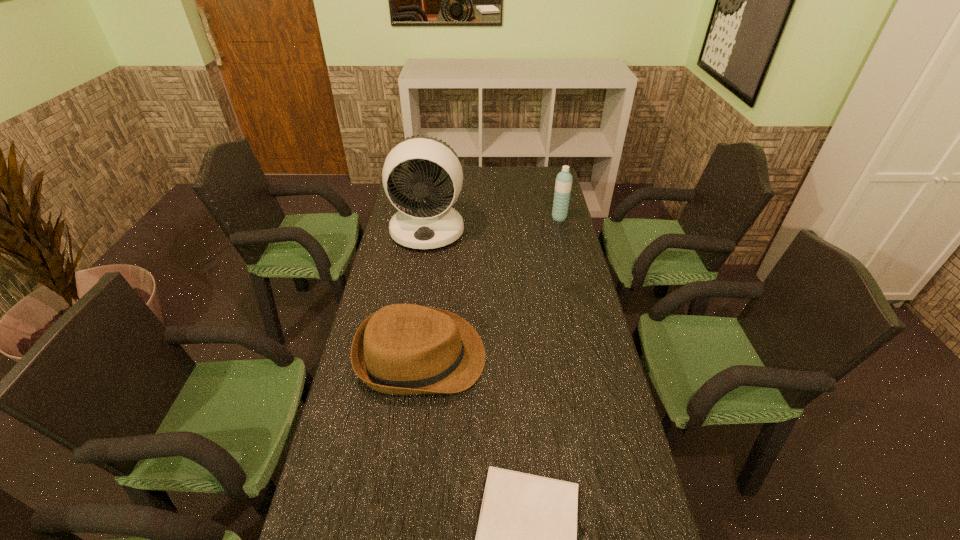
Where is `the tallest object`? the tallest object is located at coordinates (430, 223).

At what (x,y) coordinates should I click in order to perform the action: click on the third shortest object. Please return your answer as a coordinate pair (x, y). This screenshot has width=960, height=540. Looking at the image, I should click on (563, 185).

Identify the location of water bottle. Image resolution: width=960 pixels, height=540 pixels. (563, 185).

Locate an element on the screen. The width and height of the screenshot is (960, 540). the second nearest object is located at coordinates (403, 349).

The width and height of the screenshot is (960, 540). What are the coordinates of `the third tallest object` in the screenshot? It's located at (403, 349).

Find the location of a particular element. The width and height of the screenshot is (960, 540). free space located on the grille of the fan is located at coordinates pyautogui.click(x=420, y=279).

Locate an element on the screen. The width and height of the screenshot is (960, 540). free space located 0.060m on the left of the water bottle is located at coordinates (538, 218).

Where is `vacant space located on the front-facing side of the second nearest object`? The image size is (960, 540). vacant space located on the front-facing side of the second nearest object is located at coordinates (553, 356).

You are a GUI agent. You are given a task and a screenshot of the screen. Output one action in this format:
    pyautogui.click(x=<x>, y=<y>)
    Task: Click on the fan that is positioned at the left edge
    Image resolution: width=960 pixels, height=540 pixels.
    Given the screenshot: What is the action you would take?
    pyautogui.click(x=430, y=223)

Find the location of `fedora at the left edge`. fedora at the left edge is located at coordinates (403, 349).